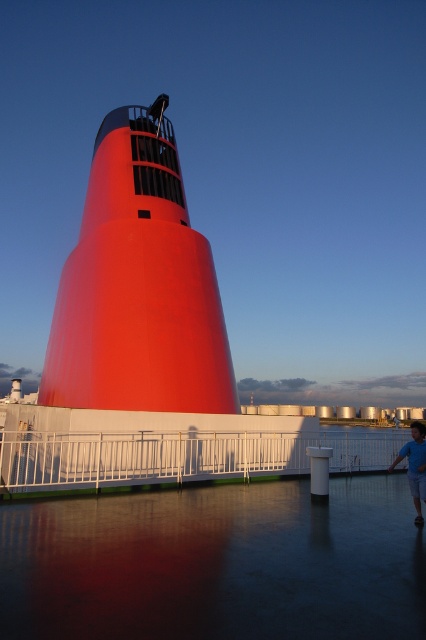
Does smooth glossy red tower at center have a greater height compared to blue cotton shirt at lower right?

Correct, smooth glossy red tower at center is much taller as blue cotton shirt at lower right.

Can you confirm if smooth glossy red tower at center is bigger than blue cotton shirt at lower right?

Yes.

Locate an element on the screen. The image size is (426, 640). smooth glossy red tower at center is located at coordinates (138, 285).

Consider the image. Does smooth glossy red tower at center lie in front of white metal railing at center?

No, it is not.

Locate an element on the screen. Image resolution: width=426 pixels, height=640 pixels. smooth glossy red tower at center is located at coordinates (138, 285).

Which is above, white metal railing at center or blue cotton shirt at lower right?

blue cotton shirt at lower right is higher up.

Between point (276, 442) and point (402, 449), which one is positioned in front?

Point (402, 449)

The image size is (426, 640). Describe the element at coordinates (178, 456) in the screenshot. I see `white metal railing at center` at that location.

Image resolution: width=426 pixels, height=640 pixels. In order to click on white metal railing at center in this screenshot , I will do `click(178, 456)`.